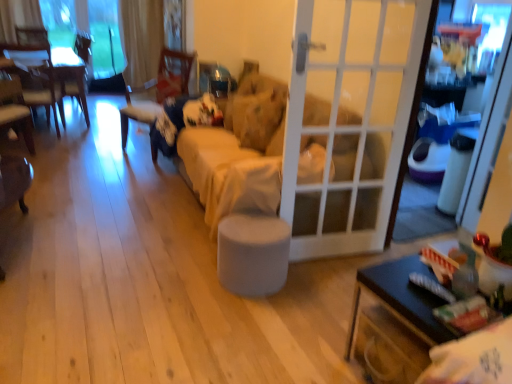
Question: Would you consider beige fabric couch at center to be distant from black glossy table at lower right, positioned as the second table in back-to-front order?

Choices:
 (A) yes
 (B) no

Answer: (A)

Question: Can you confirm if beige fabric couch at center is wider than black glossy table at lower right, positioned as the second table in back-to-front order?

Choices:
 (A) no
 (B) yes

Answer: (B)

Question: Can you confirm if beige fabric couch at center is positioned to the left of black glossy table at lower right, the 1th table in the right-to-left sequence?

Choices:
 (A) yes
 (B) no

Answer: (A)

Question: Does beige fabric couch at center have a lesser width compared to black glossy table at lower right, which is the 2th table in left-to-right order?

Choices:
 (A) no
 (B) yes

Answer: (A)

Question: Is beige fabric couch at center looking in the opposite direction of black glossy table at lower right, which is the 2th table in left-to-right order?

Choices:
 (A) yes
 (B) no

Answer: (B)

Question: In the image, is transparent glass window at upper left positioned in front of or behind black glossy table at lower right, the 1th table in the right-to-left sequence?

Choices:
 (A) behind
 (B) front

Answer: (A)

Question: Is transparent glass window at upper left inside the boundaries of black glossy table at lower right, arranged as the second table when viewed from the top, or outside?

Choices:
 (A) inside
 (B) outside

Answer: (B)

Question: Looking at their shapes, would you say transparent glass window at upper left is wider or thinner than black glossy table at lower right, which is the 2th table in left-to-right order?

Choices:
 (A) wide
 (B) thin

Answer: (B)

Question: From the image's perspective, is transparent glass window at upper left above or below black glossy table at lower right, arranged as the 1th table when viewed from the front?

Choices:
 (A) above
 (B) below

Answer: (A)

Question: From a real-world perspective, relative to transparent glass window at upper left, is gray fabric stool at center vertically above or below?

Choices:
 (A) below
 (B) above

Answer: (A)

Question: Is gray fabric stool at center in front of or behind transparent glass window at upper left in the image?

Choices:
 (A) behind
 (B) front

Answer: (B)

Question: From the image's perspective, relative to transparent glass window at upper left, is gray fabric stool at center above or below?

Choices:
 (A) above
 (B) below

Answer: (B)

Question: In terms of width, does gray fabric stool at center look wider or thinner when compared to transparent glass window at upper left?

Choices:
 (A) thin
 (B) wide

Answer: (B)

Question: Is wooden table at left, arranged as the first table when viewed from the left, situated inside white glass door at center or outside?

Choices:
 (A) outside
 (B) inside

Answer: (A)

Question: Considering the positions of wooden table at left, which appears as the 2th table when viewed from the right, and white glass door at center in the image, is wooden table at left, which appears as the 2th table when viewed from the right, taller or shorter than white glass door at center?

Choices:
 (A) short
 (B) tall

Answer: (A)